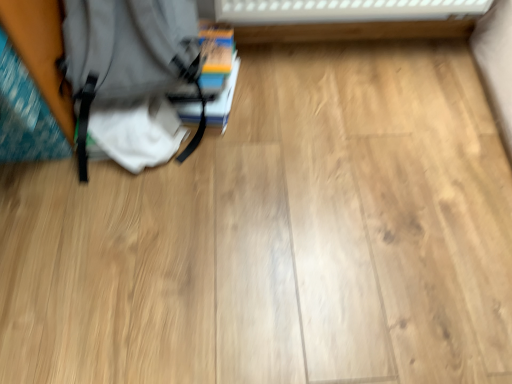
The height and width of the screenshot is (384, 512). What do you see at coordinates (218, 71) in the screenshot?
I see `hardcover book at center-left` at bounding box center [218, 71].

Image resolution: width=512 pixels, height=384 pixels. Identify the location of hardcover book at center-left. (218, 71).

Measure the distance between point (223, 43) and camera.

A distance of 1.27 meters exists between point (223, 43) and camera.

Where is `matte gray backpack at left`? This screenshot has width=512, height=384. matte gray backpack at left is located at coordinates (126, 53).

This screenshot has height=384, width=512. Describe the element at coordinates (126, 53) in the screenshot. I see `matte gray backpack at left` at that location.

The width and height of the screenshot is (512, 384). I want to click on hardcover book at center-left, so click(x=218, y=71).

Can you confirm if hardcover book at center-left is positioned to the left of matte gray backpack at left?

In fact, hardcover book at center-left is to the right of matte gray backpack at left.

Is the position of hardcover book at center-left less distant than that of matte gray backpack at left?

That is False.

Between point (180, 96) and point (71, 74), which one is positioned in front?

The point (71, 74) is in front.

From the image's perspective, which is above, hardcover book at center-left or matte gray backpack at left?

hardcover book at center-left, from the image's perspective.

From a real-world perspective, is hardcover book at center-left positioned above or below matte gray backpack at left?

Clearly, from a real-world perspective, hardcover book at center-left is below matte gray backpack at left.

Can you confirm if hardcover book at center-left is thinner than matte gray backpack at left?

No, hardcover book at center-left is not thinner than matte gray backpack at left.

Can you confirm if hardcover book at center-left is taller than matte gray backpack at left?

Incorrect, the height of hardcover book at center-left is not larger of that of matte gray backpack at left.

From the picture: Looking at the image, does hardcover book at center-left seem bigger or smaller compared to matte gray backpack at left?

Clearly, hardcover book at center-left is smaller in size than matte gray backpack at left.

Is hardcover book at center-left situated inside matte gray backpack at left or outside?

hardcover book at center-left exists outside the volume of matte gray backpack at left.

Are hardcover book at center-left and matte gray backpack at left making contact?

hardcover book at center-left and matte gray backpack at left are clearly separated.

Is hardcover book at center-left oriented towards matte gray backpack at left?

Yes, hardcover book at center-left is facing matte gray backpack at left.

How different are the orientations of hardcover book at center-left and matte gray backpack at left in degrees?

The angular difference between hardcover book at center-left and matte gray backpack at left is 7.28 degrees.

I want to click on book that appears above the matte gray backpack at left (from the image's perspective), so click(218, 71).

Between matte gray backpack at left and hardcover book at center-left, which one appears on the left side from the viewer's perspective?

matte gray backpack at left is more to the left.

Which object is more forward, matte gray backpack at left or hardcover book at center-left?

matte gray backpack at left.

Considering the points (191, 63) and (209, 58), which point is behind, point (191, 63) or point (209, 58)?

Positioned behind is point (209, 58).

From the image's perspective, relative to hardcover book at center-left, is matte gray backpack at left above or below?

Clearly, from the image's perspective, matte gray backpack at left is below hardcover book at center-left.

From a real-world perspective, relative to hardcover book at center-left, is matte gray backpack at left vertically above or below?

From a real-world perspective, matte gray backpack at left is physically above hardcover book at center-left.

Which object is thinner, matte gray backpack at left or hardcover book at center-left?

matte gray backpack at left.

Which of these two, matte gray backpack at left or hardcover book at center-left, stands taller?

matte gray backpack at left.

Does matte gray backpack at left have a larger size compared to hardcover book at center-left?

Yes.

Would you say matte gray backpack at left is outside hardcover book at center-left?

Yes.

Is matte gray backpack at left not near hardcover book at center-left?

That's not correct — matte gray backpack at left is a little close to hardcover book at center-left.

From the picture: Is hardcover book at center-left at the back of matte gray backpack at left?

No, matte gray backpack at left's orientation is not away from hardcover book at center-left.

How many degrees apart are the facing directions of matte gray backpack at left and hardcover book at center-left?

The facing directions of matte gray backpack at left and hardcover book at center-left are 7.28 degrees apart.

The image size is (512, 384). Find the location of `book that is above the matte gray backpack at left (from the image's perspective)`. book that is above the matte gray backpack at left (from the image's perspective) is located at coordinates (218, 71).

I want to click on backpack lying in front of the hardcover book at center-left, so click(126, 53).

You are a GUI agent. You are given a task and a screenshot of the screen. Output one action in this format:
    pyautogui.click(x=<x>, y=<y>)
    Task: Click on the book above the matte gray backpack at left (from the image's perspective)
    The image size is (512, 384).
    Given the screenshot: What is the action you would take?
    pyautogui.click(x=218, y=71)